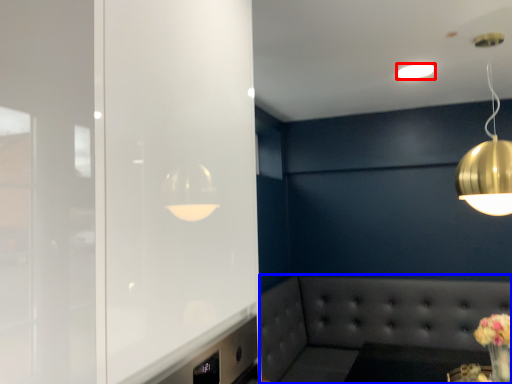
Question: Which point is further to the camera, lamp (highlighted by a red box) or couch (highlighted by a blue box)?

Choices:
 (A) lamp
 (B) couch

Answer: (B)